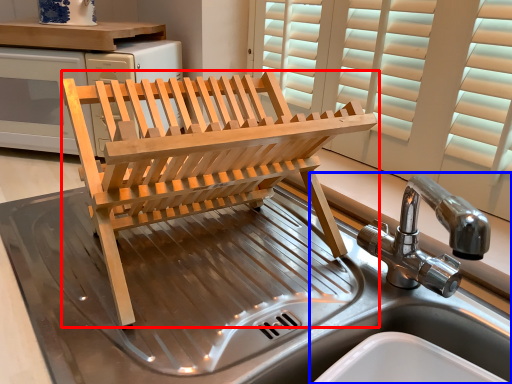
Question: Which object appears closest to the camera in this image, furniture (highlighted by a red box) or sink (highlighted by a blue box)?

Choices:
 (A) furniture
 (B) sink

Answer: (B)